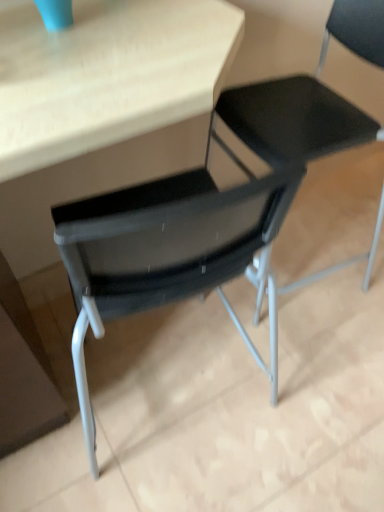
I want to click on vacant space underneath matte wood table at center (from a real-world perspective), so click(x=165, y=377).